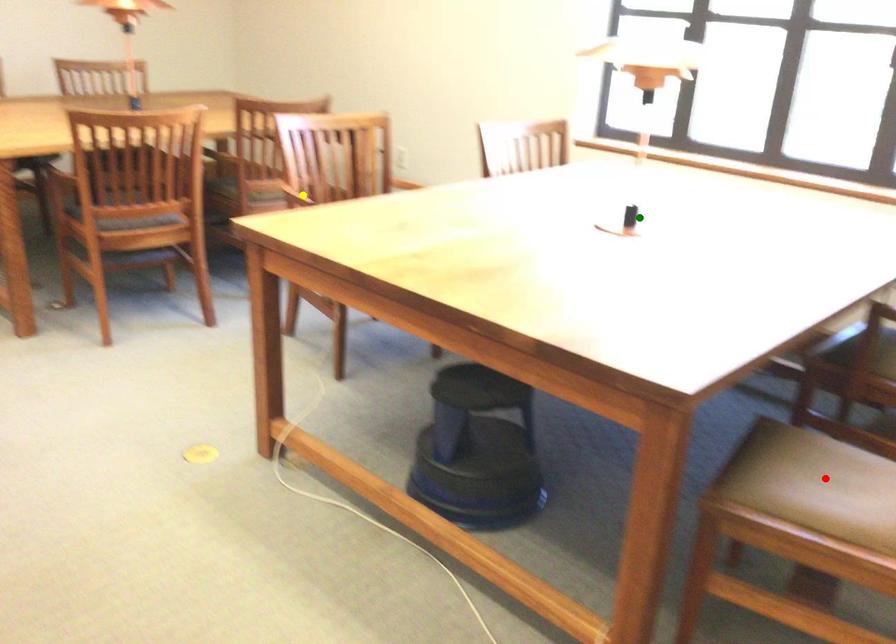
Order these from nearest to farthest:
A) yellow point
B) red point
C) green point

red point
green point
yellow point